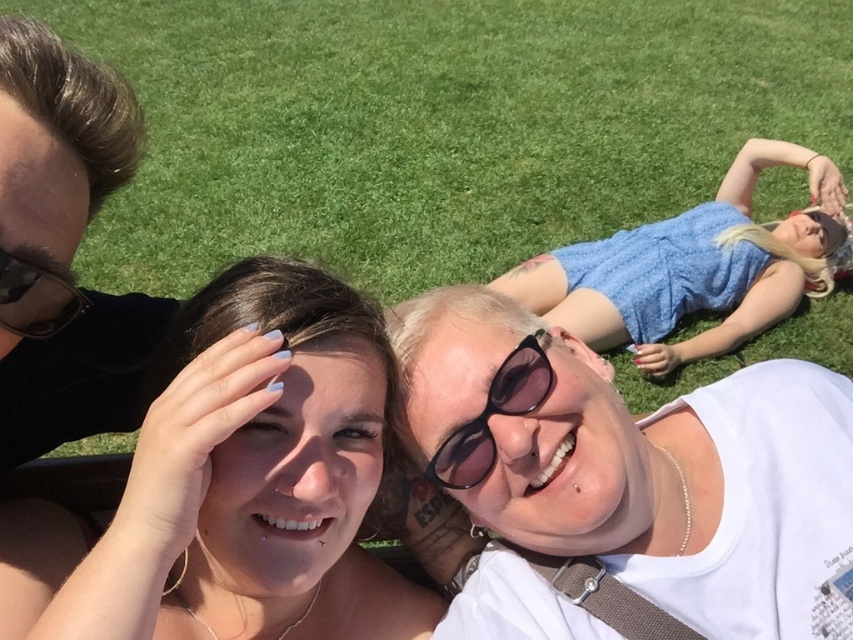
Does green grass at upper center appear over smooth skin face at center?

Yes.

Does green grass at upper center have a greater height compared to smooth skin face at center?

Yes, green grass at upper center is taller than smooth skin face at center.

Between point (360, 179) and point (280, 340), which one is positioned behind?

The point (360, 179) is behind.

Identify the location of green grass at upper center. (438, 125).

Does black plastic sunglasses at center have a greater height compared to matte black sunglasses at upper left?

Yes, black plastic sunglasses at center is taller than matte black sunglasses at upper left.

At what (x,y) coordinates should I click in order to perform the action: click on black plastic sunglasses at center. Please return your answer as a coordinate pair (x, y). The image size is (853, 640). Looking at the image, I should click on (492, 413).

I want to click on black plastic sunglasses at center, so click(492, 413).

Can you confirm if green grass at upper center is smaller than matte black sunglasses at upper left?

No.

Is green grass at upper center positioned at the back of matte black sunglasses at upper left?

Yes.

Which is in front, point (167, 266) or point (45, 332)?

Point (45, 332) is more forward.

Find the location of a particular element. The width and height of the screenshot is (853, 640). green grass at upper center is located at coordinates (438, 125).